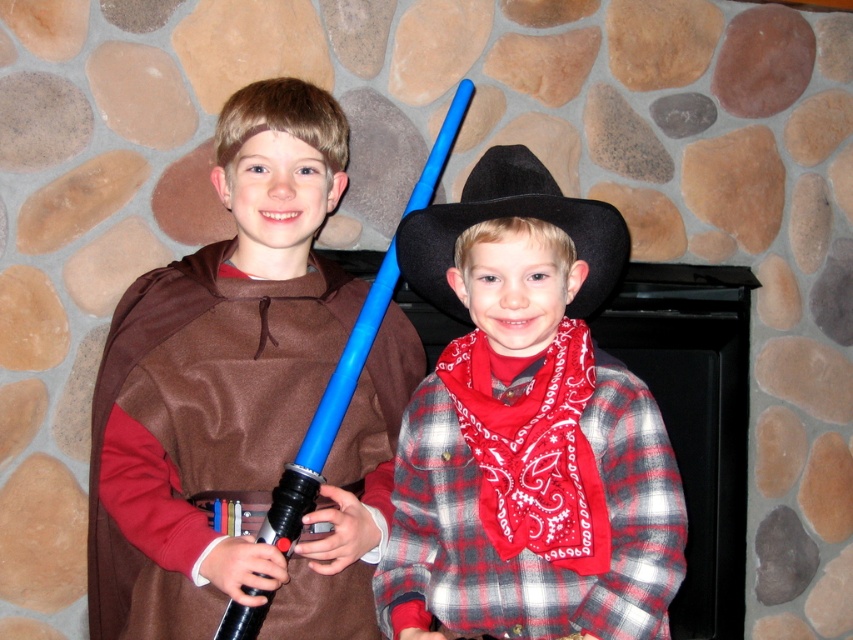
Between matte brown cape at left and black felt cowboy hat at center, which one has more height?

matte brown cape at left

Measure the distance between matte brown cape at left and camera.

matte brown cape at left is 1.37 meters from camera.

At what (x,y) coordinates should I click in order to perform the action: click on matte brown cape at left. Please return your answer as a coordinate pair (x, y). The width and height of the screenshot is (853, 640). Looking at the image, I should click on (242, 396).

Consider the image. Does red bandana at center have a lesser width compared to black felt cowboy hat at center?

Yes, red bandana at center is thinner than black felt cowboy hat at center.

Locate an element on the screen. red bandana at center is located at coordinates (532, 451).

Does point (538, 474) come in front of point (465, 216)?

Yes, it is in front of point (465, 216).

Locate an element on the screen. The width and height of the screenshot is (853, 640). red bandana at center is located at coordinates (532, 451).

Which is below, matte brown cape at left or plaid flannel shirt at center?

Positioned lower is plaid flannel shirt at center.

This screenshot has height=640, width=853. Describe the element at coordinates (242, 396) in the screenshot. I see `matte brown cape at left` at that location.

Identify the location of matte brown cape at left. This screenshot has width=853, height=640. (242, 396).